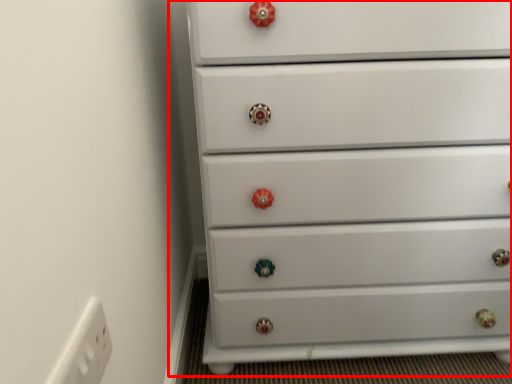
Question: Observing the image, what is the correct spatial positioning of chest of drawers (annotated by the red box) in reference to electric outlet?

Choices:
 (A) left
 (B) right

Answer: (B)